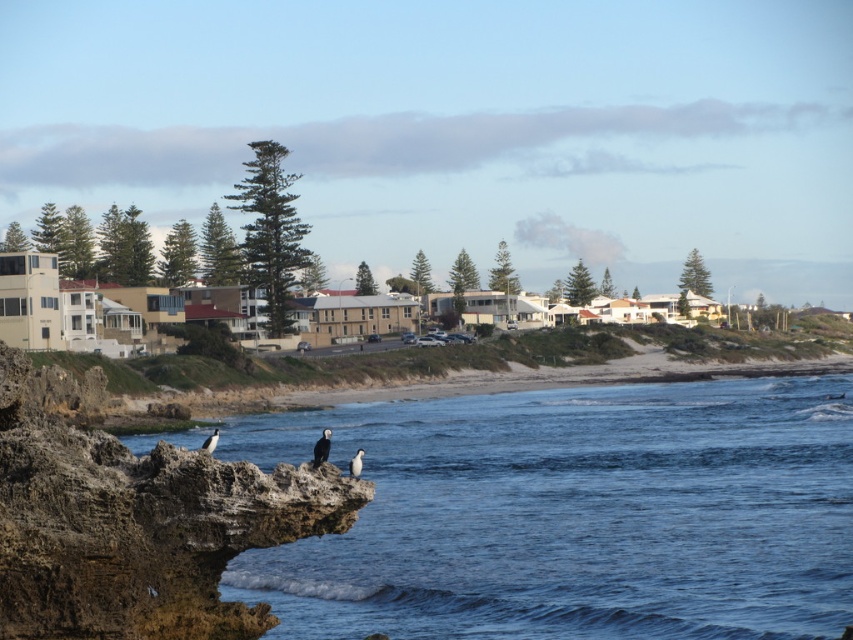
Question: Can you confirm if black feathered bird at lower left is thinner than white glossy bird at lower center?

Choices:
 (A) no
 (B) yes

Answer: (A)

Question: Which of the following is the closest to the observer?

Choices:
 (A) brown rocky cliff at lower left
 (B) black feathered bird at lower left
 (C) white glossy bird at lower center

Answer: (A)

Question: Can you confirm if black feathered bird at lower left is smaller than white glossy bird at lower center?

Choices:
 (A) no
 (B) yes

Answer: (A)

Question: Which is farther from the brown rocky cliff at lower left?

Choices:
 (A) black feathered bird at lower left
 (B) white glossy bird at lower center

Answer: (B)

Question: Is brown rocky cliff at lower left to the right of white glossy bird at lower center from the viewer's perspective?

Choices:
 (A) no
 (B) yes

Answer: (A)

Question: Which object is positioned closest to the blue water at lower left?

Choices:
 (A) white glossy bird at lower center
 (B) white feathered bird at lower left

Answer: (B)